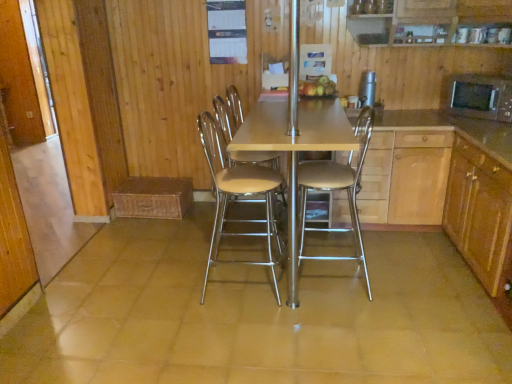
Question: From the image's perspective, relative to black matte microwave at right, the first appliance viewed from the right, is matte wooden table at center above or below?

Choices:
 (A) above
 (B) below

Answer: (B)

Question: In terms of height, does matte wooden table at center look taller or shorter compared to black matte microwave at right, the 2th appliance in the left-to-right sequence?

Choices:
 (A) tall
 (B) short

Answer: (A)

Question: Considering the real-world distances, which object is closest to the black matte microwave at right, the first appliance viewed from the right?

Choices:
 (A) metallic stainless steel water dispenser at upper center, which is the second appliance from right to left
 (B) metallic beige stool at center, arranged as the second chair when viewed from the left
 (C) beige leather chair at center, the 2th chair in the right-to-left sequence
 (D) matte wooden table at center
 (E) shiny golden apples at center

Answer: (A)

Question: Which of these objects is positioned farthest from the metallic beige stool at center, arranged as the second chair when viewed from the left?

Choices:
 (A) beige leather chair at center, the 2th chair in the right-to-left sequence
 (B) metallic stainless steel water dispenser at upper center, which is the 1th appliance from left to right
 (C) shiny golden apples at center
 (D) matte wooden table at center
 (E) black matte microwave at right, the 2th appliance in the left-to-right sequence

Answer: (E)